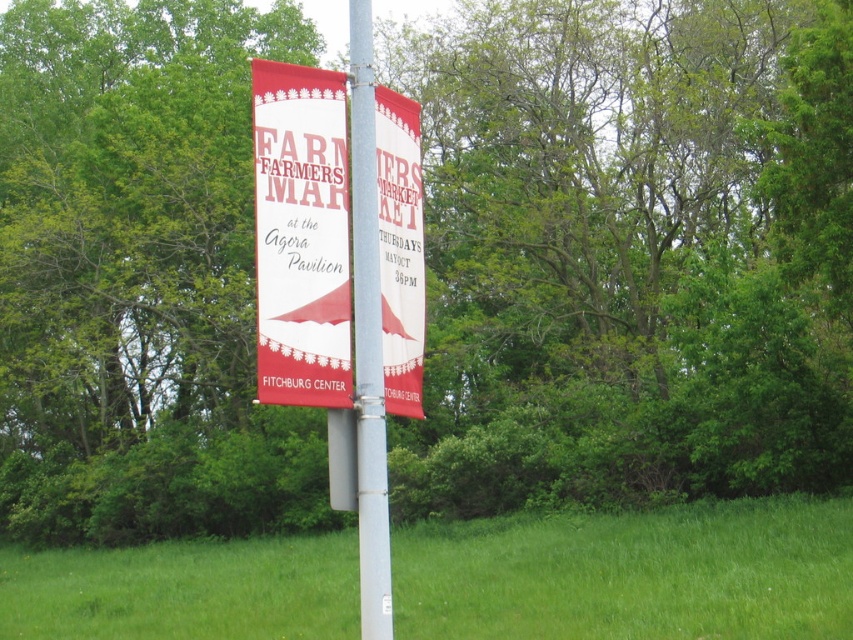
You are planning to place a new decorative flag that is 1 meter wide. The flag needs to be placed between the green grass at center and the metallic silver pole at center. Considering their sizes, will the flag fit comfortably between them without overlapping either?

The green grass at center is bigger than the metallic silver pole at center. Since the flag is 1 meter wide, it can fit comfortably between them as long as the space between the two objects is at least 1 meter. However, the exact distance isn